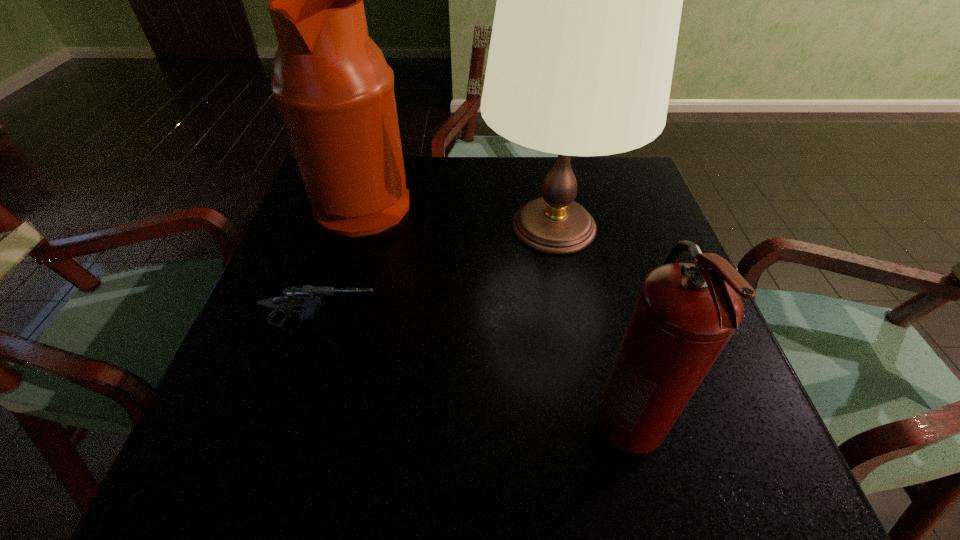
At what (x,y) coordinates should I click in order to perform the action: click on water jug positioned at the far edge. Please return your answer as a coordinate pair (x, y). Looking at the image, I should click on (335, 91).

Locate an element on the screen. The height and width of the screenshot is (540, 960). object situated at the near edge is located at coordinates (685, 314).

Find the location of a particular element. The height and width of the screenshot is (540, 960). water jug located at the left edge is located at coordinates (335, 91).

I want to click on gun that is at the left edge, so click(309, 298).

This screenshot has height=540, width=960. I want to click on lamp located at the right edge, so click(x=589, y=0).

Where is `fire extinguisher present at the right edge`? The width and height of the screenshot is (960, 540). fire extinguisher present at the right edge is located at coordinates pyautogui.click(x=685, y=314).

Locate an element on the screen. The height and width of the screenshot is (540, 960). object that is positioned at the far left corner is located at coordinates point(335,91).

This screenshot has height=540, width=960. I want to click on object that is at the far right corner, so pos(589,0).

Image resolution: width=960 pixels, height=540 pixels. In order to click on object located in the near right corner section of the desktop in this screenshot , I will do `click(685, 314)`.

Where is `blank area at the far edge`? blank area at the far edge is located at coordinates (453, 161).